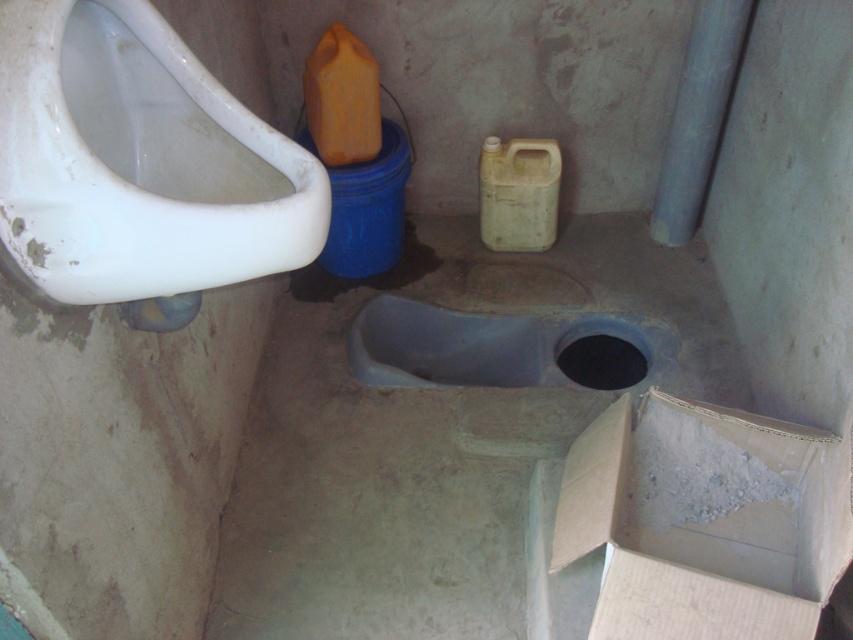
Based on the photo, you are a maintenance worker inspecting the restroom. You need to replace the smaller object between the white glossy urinal at left and the matte plastic toilet bowl at center. Which one should you replace?

The matte plastic toilet bowl at center is smaller than the white glossy urinal at left, so you should replace the matte plastic toilet bowl at center.